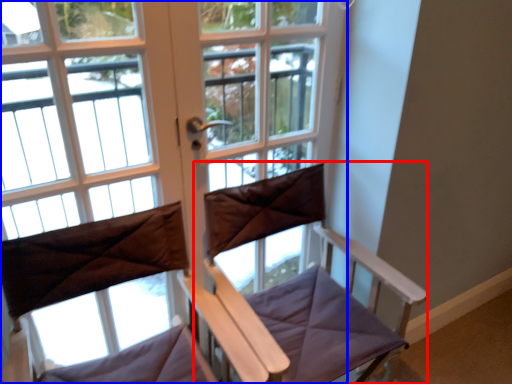
Question: Which object appears farthest to the camera in this image, feeding chair (highlighted by a red box) or window (highlighted by a blue box)?

Choices:
 (A) feeding chair
 (B) window

Answer: (B)